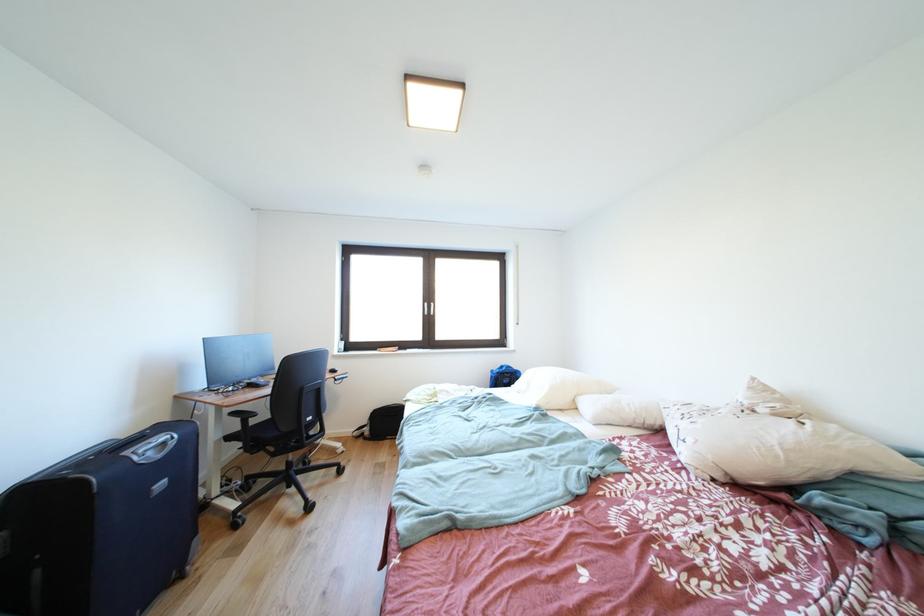
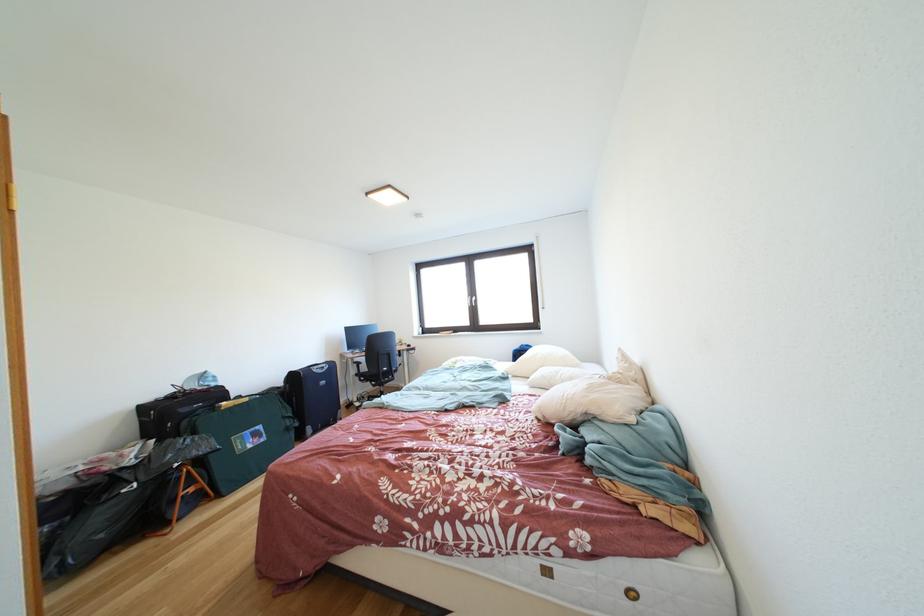
In the second image, find the point that corresponds to point 283,459 in the first image.

(383, 391)